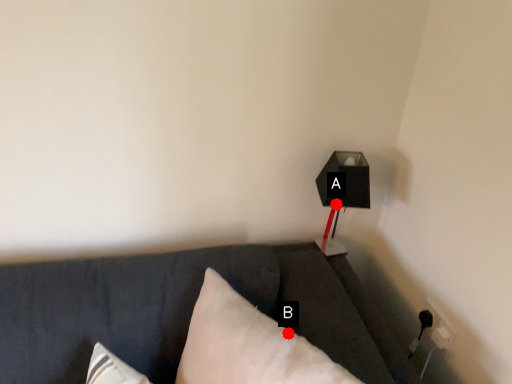
Question: Two points are circled on the image, labeled by A and B beside each circle. Which point is farther to the camera?

Choices:
 (A) A is further
 (B) B is further

Answer: (A)